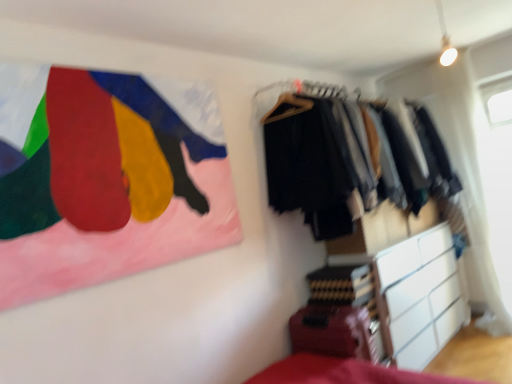
Question: Would you say transparent plastic window screen at upper right is outside white matte chest of drawers at lower right?

Choices:
 (A) yes
 (B) no

Answer: (A)

Question: From a real-world perspective, is transparent plastic window screen at upper right on top of white matte chest of drawers at lower right?

Choices:
 (A) yes
 (B) no

Answer: (A)

Question: Is transparent plastic window screen at upper right thinner than white matte chest of drawers at lower right?

Choices:
 (A) no
 (B) yes

Answer: (B)

Question: Does transparent plastic window screen at upper right have a lesser height compared to white matte chest of drawers at lower right?

Choices:
 (A) no
 (B) yes

Answer: (A)

Question: Is transparent plastic window screen at upper right to the right of white matte chest of drawers at lower right from the viewer's perspective?

Choices:
 (A) no
 (B) yes

Answer: (B)

Question: Considering the positions of point (22, 132) and point (393, 289), is point (22, 132) closer or farther from the camera than point (393, 289)?

Choices:
 (A) closer
 (B) farther

Answer: (A)

Question: From the image's perspective, relative to white matte chest of drawers at lower right, is painted fabric flag at upper left above or below?

Choices:
 (A) below
 (B) above

Answer: (B)

Question: Based on their sizes in the image, would you say painted fabric flag at upper left is bigger or smaller than white matte chest of drawers at lower right?

Choices:
 (A) big
 (B) small

Answer: (B)

Question: Choose the correct answer: Is painted fabric flag at upper left inside white matte chest of drawers at lower right or outside it?

Choices:
 (A) outside
 (B) inside

Answer: (A)

Question: In the image, is textured fabric clothes at right positioned in front of or behind transparent plastic window screen at upper right?

Choices:
 (A) front
 (B) behind

Answer: (A)

Question: Visually, is textured fabric clothes at right positioned to the left or to the right of transparent plastic window screen at upper right?

Choices:
 (A) left
 (B) right

Answer: (A)

Question: From a real-world perspective, is textured fabric clothes at right positioned above or below transparent plastic window screen at upper right?

Choices:
 (A) above
 (B) below

Answer: (A)

Question: Based on their sizes in the image, would you say textured fabric clothes at right is bigger or smaller than transparent plastic window screen at upper right?

Choices:
 (A) big
 (B) small

Answer: (A)

Question: From the image's perspective, is textured fabric clothes at right located above or below white matte chest of drawers at lower right?

Choices:
 (A) above
 (B) below

Answer: (A)

Question: Do you think textured fabric clothes at right is within white matte chest of drawers at lower right, or outside of it?

Choices:
 (A) inside
 (B) outside

Answer: (B)